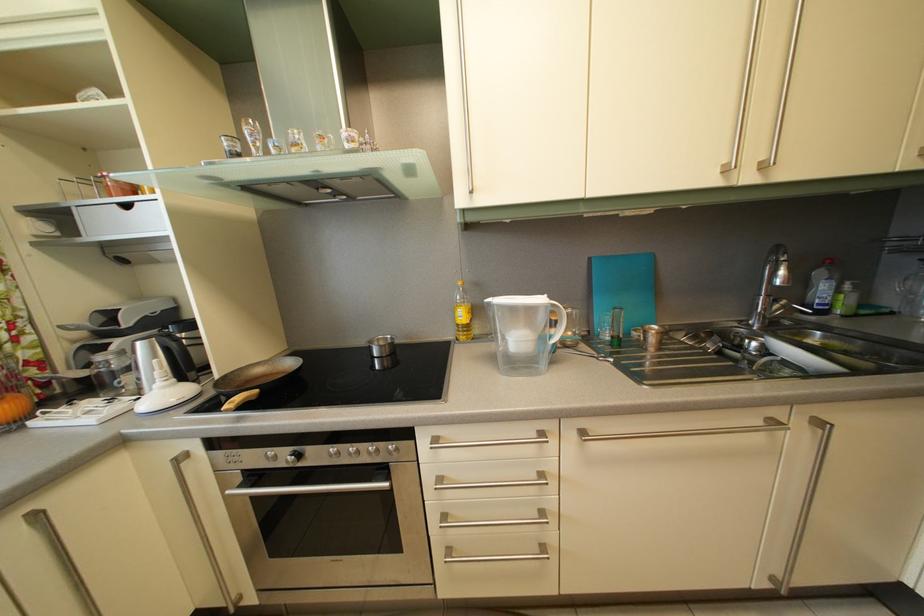
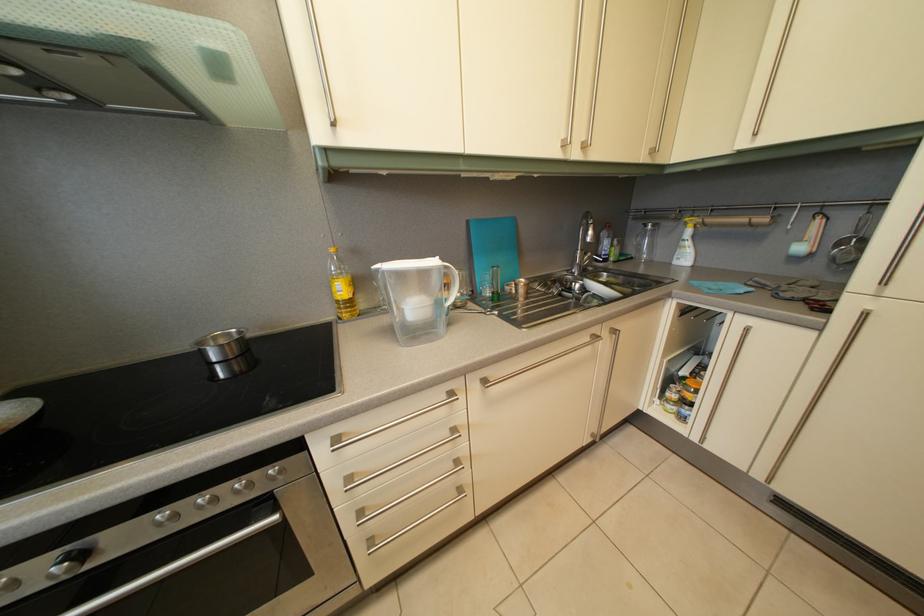
In the second image, find the point that corresponds to (762,163) in the first image.

(588, 143)